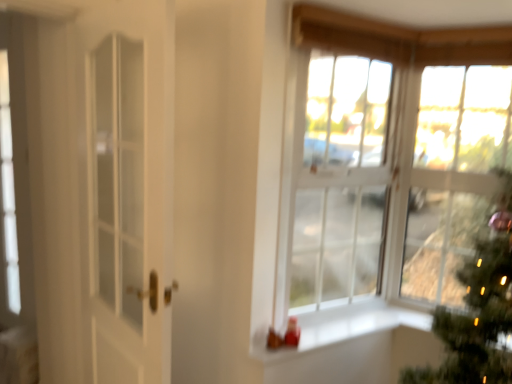
Question: Based on their positions, is white glass window at center, which appears as the 2th window when viewed from the back, located to the left or right of clear glass window at upper right, arranged as the 3th window when viewed from the front?

Choices:
 (A) right
 (B) left

Answer: (B)

Question: From their relative heights in the image, would you say white glass window at center, the 2th window when ordered from front to back, is taller or shorter than clear glass window at upper right, arranged as the 3th window when viewed from the front?

Choices:
 (A) short
 (B) tall

Answer: (B)

Question: Considering the real-world distances, which object is farthest from the white glass window at center, the 2th window when ordered from front to back?

Choices:
 (A) clear glass window at upper right, which is the 3th window from back to front
 (B) clear glass window at upper right, arranged as the 3th window when viewed from the front
 (C) white smooth window sill at center
 (D) white glossy door at left

Answer: (D)

Question: Which of these objects is positioned farthest from the white smooth window sill at center?

Choices:
 (A) clear glass window at upper right, the first window from the back
 (B) white glossy door at left
 (C) clear glass window at upper right, which appears as the first window when viewed from the front
 (D) white glass window at center, the 2th window when ordered from front to back

Answer: (B)